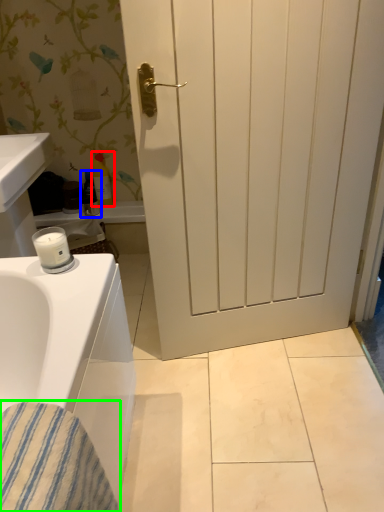
Question: Estimate the real-world distances between objects in this image. Which object is closer to toiletry (highlighted by a red box), toiletry (highlighted by a blue box) or material (highlighted by a green box)?

Choices:
 (A) toiletry
 (B) material

Answer: (A)